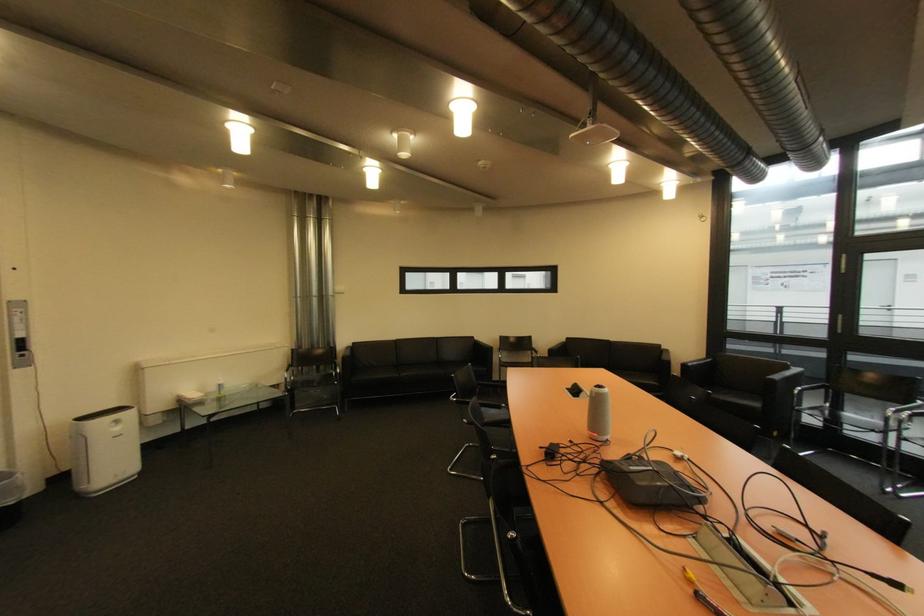
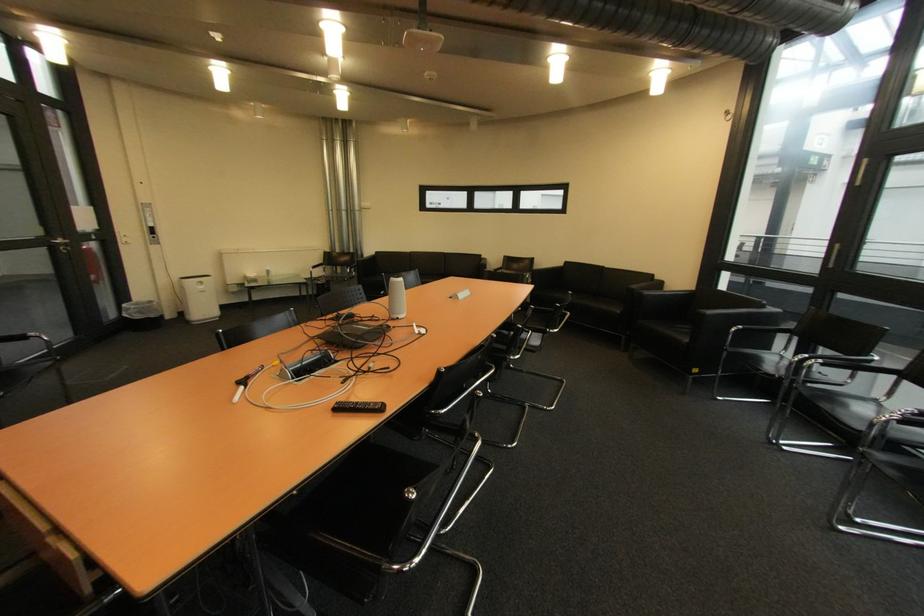
In the second image, find the point that corresponds to point (124, 430) in the first image.

(209, 288)